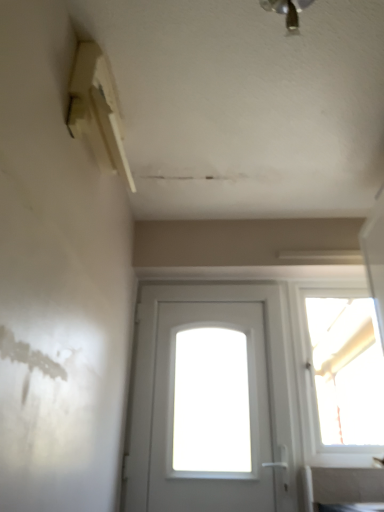
At what (x,y) coordinates should I click in order to perform the action: click on transparent glass window at upper right. Please return your answer as a coordinate pair (x, y). This screenshot has height=512, width=384. Looking at the image, I should click on (342, 373).

Identify the location of metallic ceiling light at upper center. (287, 11).

Is white matte door at center completely or partially inside transparent glass window at upper right?

No, white matte door at center is not surrounded by transparent glass window at upper right.

Are transparent glass window at upper right and white matte door at center far apart?

No, transparent glass window at upper right is not far from white matte door at center.

You are a GUI agent. You are given a task and a screenshot of the screen. Output one action in this format:
    pyautogui.click(x=<x>, y=<y>)
    Task: Click on the door on the left of transparent glass window at upper right
    The width and height of the screenshot is (384, 512).
    Given the screenshot: What is the action you would take?
    pyautogui.click(x=173, y=399)

From a real-world perspective, is transparent glass window at upper right located higher than metallic ceiling light at upper center?

Actually, transparent glass window at upper right is physically below metallic ceiling light at upper center in the real world.

In the scene shown: Do you think transparent glass window at upper right is within metallic ceiling light at upper center, or outside of it?

transparent glass window at upper right is outside metallic ceiling light at upper center.

Consider the image. Can you tell me how much transparent glass window at upper right and metallic ceiling light at upper center differ in facing direction?

86.8 degrees.

Is transparent glass window at upper right positioned with its back to metallic ceiling light at upper center?

transparent glass window at upper right is not turned away from metallic ceiling light at upper center.

Can you tell me how much white matte door at center and metallic ceiling light at upper center differ in facing direction?

They differ by 86.4 degrees in their facing directions.

Is white matte door at center surrounding metallic ceiling light at upper center?

Definitely not — metallic ceiling light at upper center is not inside white matte door at center.

You are a GUI agent. You are given a task and a screenshot of the screen. Output one action in this format:
    pyautogui.click(x=<x>, y=<y>)
    Task: Click on the light fixture in front of the white matte door at center
    
    Given the screenshot: What is the action you would take?
    pyautogui.click(x=287, y=11)

Does white matte door at center lie behind metallic ceiling light at upper center?

Yes, it is behind metallic ceiling light at upper center.

From the image's perspective, which one is positioned higher, white matte door at center or transparent glass window at upper right?

transparent glass window at upper right.

Which object is wider, white matte door at center or transparent glass window at upper right?

white matte door at center is wider.

Is point (248, 354) in front of point (324, 408)?

That is False.

Could you tell me if metallic ceiling light at upper center is turned towards transparent glass window at upper right?

No, metallic ceiling light at upper center is not aimed at transparent glass window at upper right.

The image size is (384, 512). Find the location of `window lying on the right of metallic ceiling light at upper center`. window lying on the right of metallic ceiling light at upper center is located at coordinates (342, 373).

Which of these two, metallic ceiling light at upper center or transparent glass window at upper right, stands shorter?

metallic ceiling light at upper center is shorter.

Are metallic ceiling light at upper center and transparent glass window at upper right located far from each other?

metallic ceiling light at upper center is far away from transparent glass window at upper right.

Which of these two, metallic ceiling light at upper center or white matte door at center, stands taller?

white matte door at center.

Based on the photo, is metallic ceiling light at upper center looking in the opposite direction of white matte door at center?

That's not correct — metallic ceiling light at upper center is not looking away from white matte door at center.

From the image's perspective, does metallic ceiling light at upper center appear higher than white matte door at center?

Yes, from the image's perspective, metallic ceiling light at upper center is on top of white matte door at center.

From a real-world perspective, is metallic ceiling light at upper center below white matte door at center?

No.

What are the coordinates of `door in front of the transparent glass window at upper right` in the screenshot? It's located at (173, 399).

Where is `window behind the metallic ceiling light at upper center`? The width and height of the screenshot is (384, 512). window behind the metallic ceiling light at upper center is located at coordinates (342, 373).

Which object lies nearer to the anchor point white matte door at center, metallic ceiling light at upper center or transparent glass window at upper right?

Based on the image, transparent glass window at upper right appears to be nearer to white matte door at center.

Looking at the image, which one is located further to metallic ceiling light at upper center, transparent glass window at upper right or white matte door at center?

white matte door at center is further to metallic ceiling light at upper center.

Based on their spatial positions, is metallic ceiling light at upper center or white matte door at center closer to transparent glass window at upper right?

white matte door at center.

Based on their spatial positions, is white matte door at center or metallic ceiling light at upper center further from transparent glass window at upper right?

metallic ceiling light at upper center lies further to transparent glass window at upper right than the other object.

Looking at the image, which one is located further to white matte door at center, transparent glass window at upper right or metallic ceiling light at upper center?

metallic ceiling light at upper center lies further to white matte door at center than the other object.

Considering their positions, is white matte door at center positioned further to metallic ceiling light at upper center than transparent glass window at upper right?

The object further to metallic ceiling light at upper center is white matte door at center.

Where is `window between metallic ceiling light at upper center and white matte door at center from top to bottom`? The height and width of the screenshot is (512, 384). window between metallic ceiling light at upper center and white matte door at center from top to bottom is located at coordinates (342, 373).